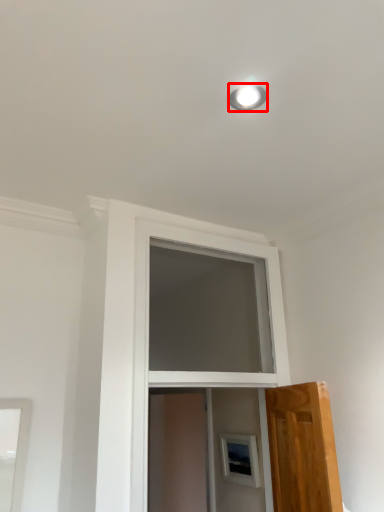
Question: In this image, where is lighting (annotated by the red box) located relative to screen door?

Choices:
 (A) right
 (B) left

Answer: (A)